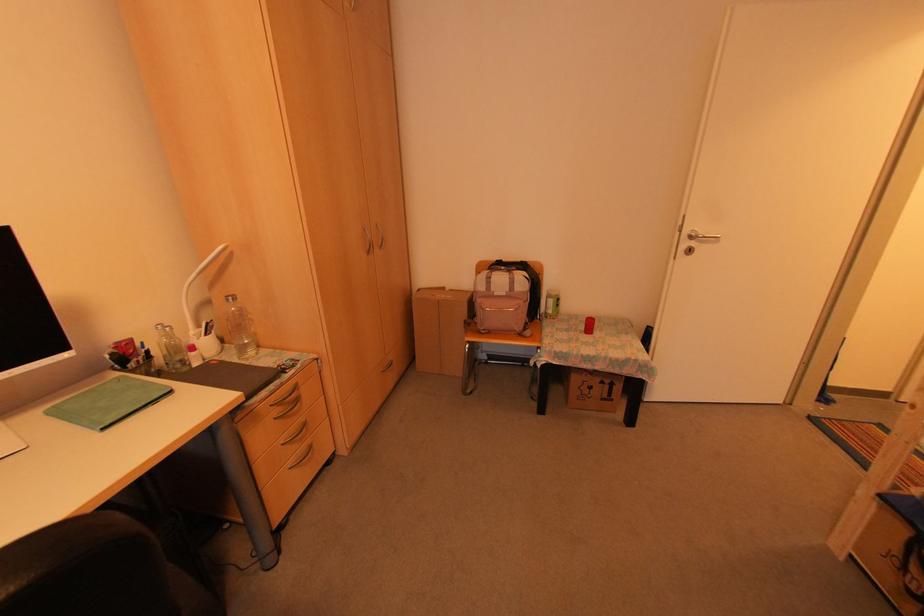
This screenshot has height=616, width=924. What do you see at coordinates (285, 395) in the screenshot?
I see `a silver drawer handle` at bounding box center [285, 395].